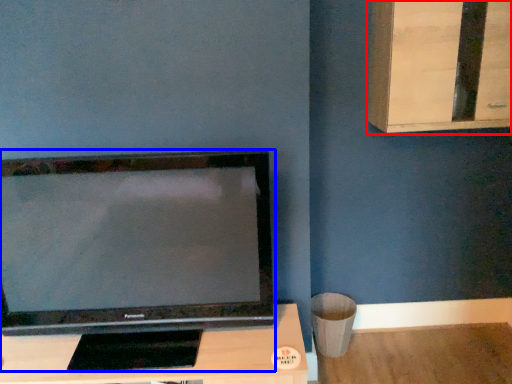
Question: Which point is further to the camera, dresser (highlighted by a red box) or television (highlighted by a blue box)?

Choices:
 (A) dresser
 (B) television

Answer: (A)